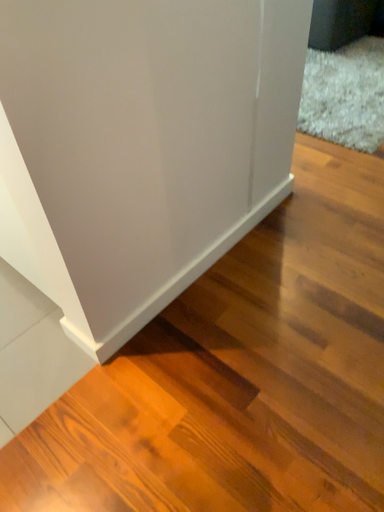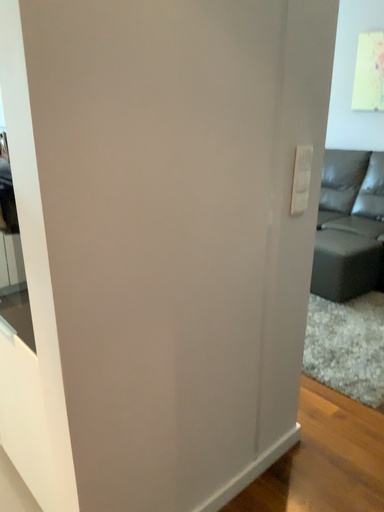
Question: Which way did the camera rotate in the video?

Choices:
 (A) rotated upward
 (B) rotated downward

Answer: (A)